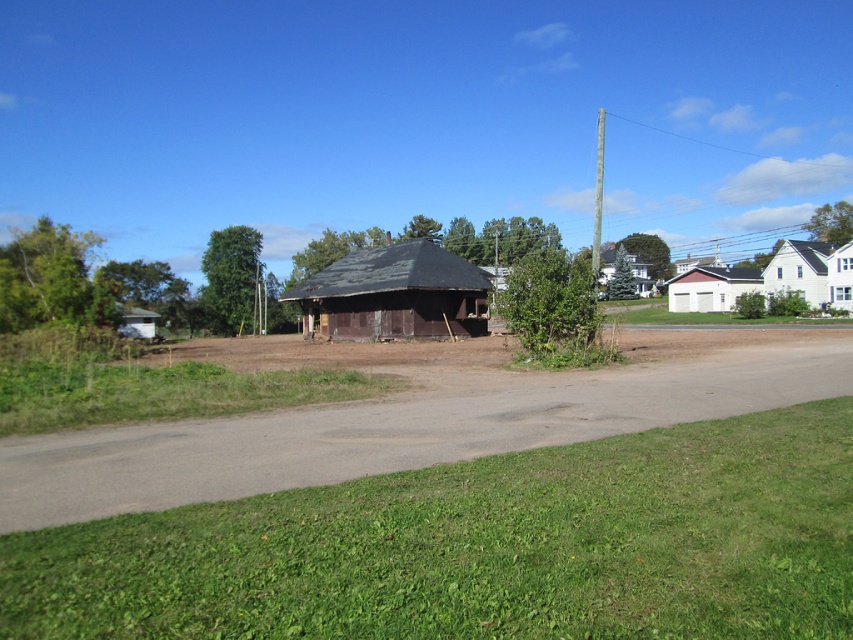
Question: Can you confirm if brown dirt track at center is smaller than weathered wood gazebo at center?

Choices:
 (A) no
 (B) yes

Answer: (A)

Question: Estimate the real-world distances between objects in this image. Which object is farther from the brown dirt track at center?

Choices:
 (A) wooden hut at center
 (B) white matte garage at right

Answer: (B)

Question: Is weathered wood gazebo at center to the left of white matte garage at right from the viewer's perspective?

Choices:
 (A) no
 (B) yes

Answer: (B)

Question: Which point appears farthest from the camera in this image?

Choices:
 (A) 811,272
 (B) 734,272
 (C) 122,461
 (D) 846,291

Answer: (B)

Question: Can you confirm if brown dirt track at center is bigger than white matte house at upper right?

Choices:
 (A) yes
 (B) no

Answer: (B)

Question: Estimate the real-world distances between objects in this image. Which object is closer to the wooden hut at center?

Choices:
 (A) brown dirt track at center
 (B) weathered wood gazebo at center

Answer: (A)